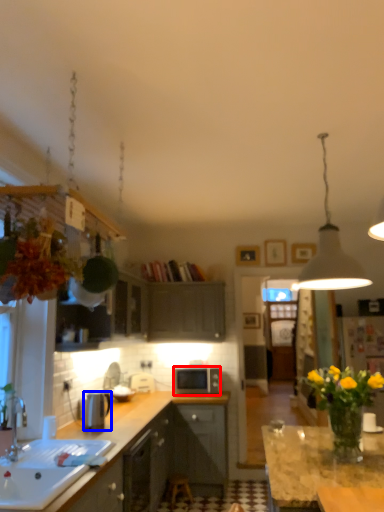
Question: Which of the following is the closest to the observer, microwave oven (highlighted by a red box) or kitchen appliance (highlighted by a blue box)?

Choices:
 (A) microwave oven
 (B) kitchen appliance

Answer: (B)